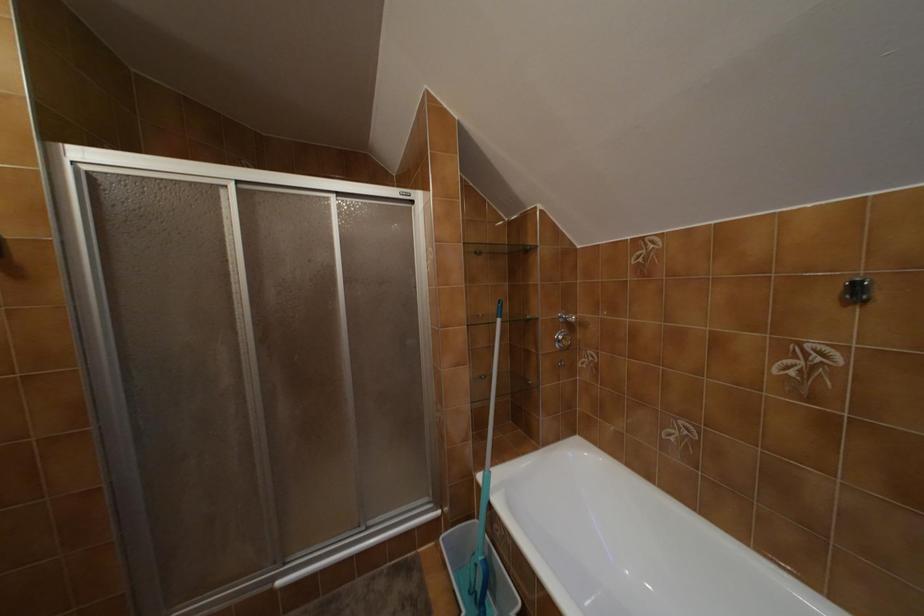
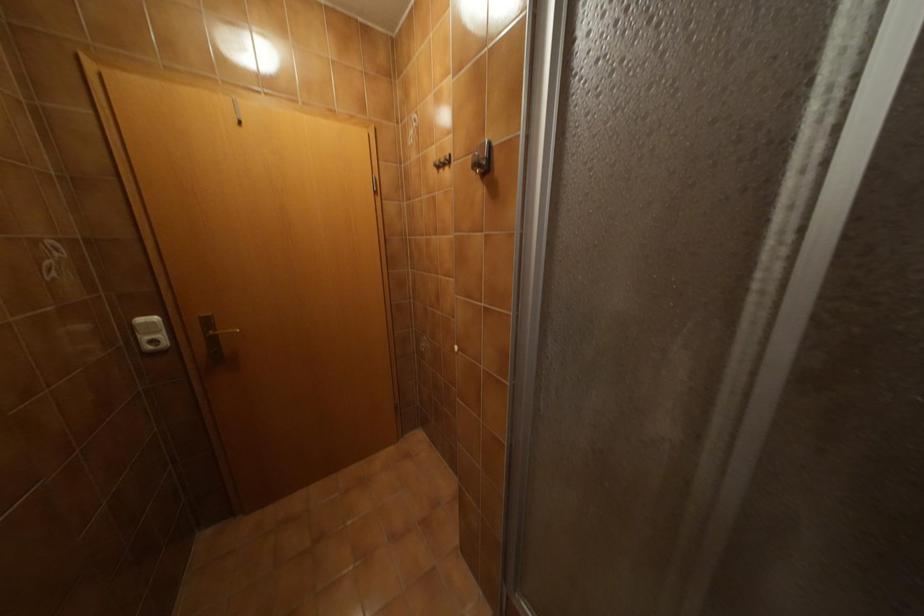
First-person continuous shooting, in which direction is the camera rotating?

The rotation direction of the camera is left-down.